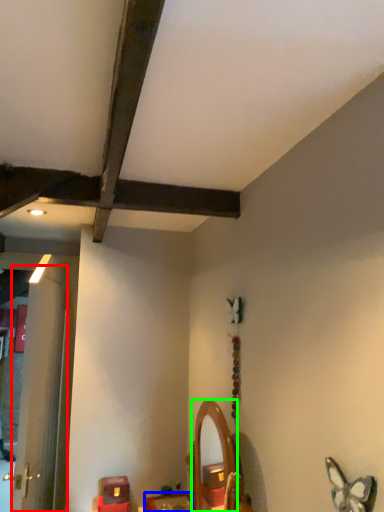
Question: Which object is the closest to the door (highlighted by a red box)? Choose among these: furniture (highlighted by a blue box) or mirror (highlighted by a green box).

Choices:
 (A) furniture
 (B) mirror

Answer: (A)